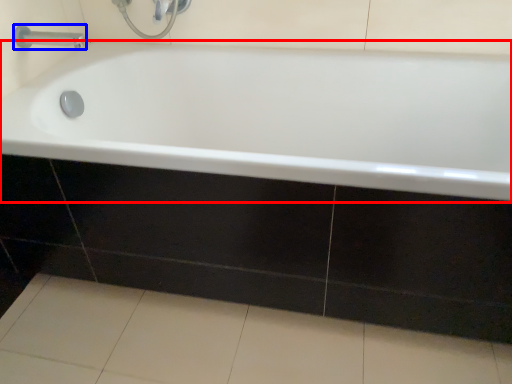
Question: Which object appears farthest to the camera in this image, bathtub (highlighted by a red box) or tap (highlighted by a blue box)?

Choices:
 (A) bathtub
 (B) tap

Answer: (B)